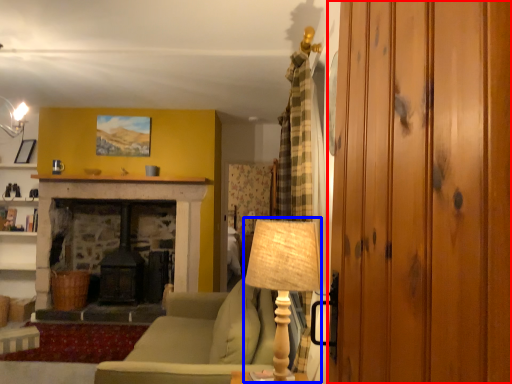
Question: Which point is closer to the camera, glass door (highlighted by a red box) or table lamp (highlighted by a blue box)?

Choices:
 (A) glass door
 (B) table lamp

Answer: (A)